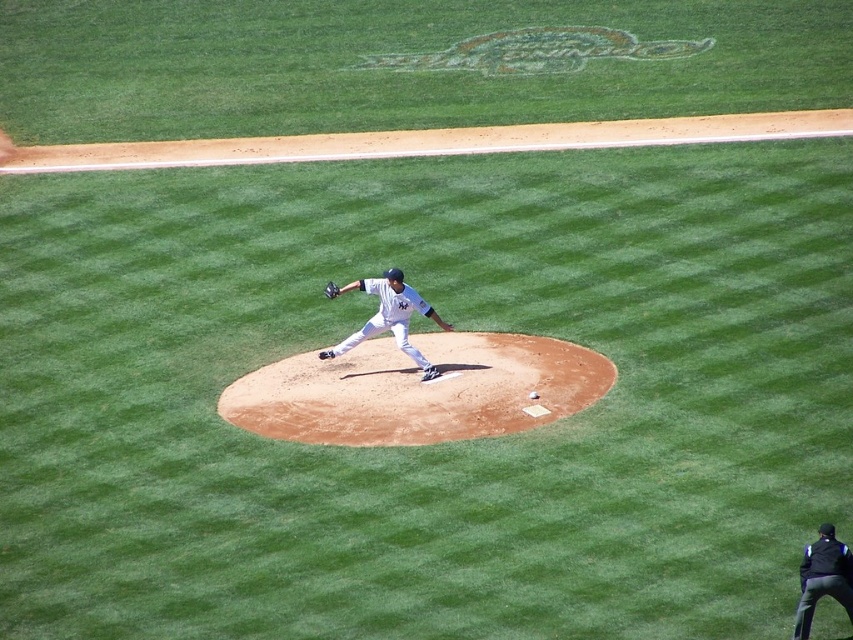
How much distance is there between white matte uniform at center and white matte baseball at center?

white matte uniform at center is 1.68 meters away from white matte baseball at center.

Is white matte uniform at center in front of white matte baseball at center?

No, it is not.

Image resolution: width=853 pixels, height=640 pixels. Find the location of `white matte uniform at center`. white matte uniform at center is located at coordinates (390, 317).

I want to click on white matte uniform at center, so click(390, 317).

Who is more distant from viewer, (409, 301) or (326, 289)?

Positioned behind is point (326, 289).

Does point (404, 321) come closer to viewer compared to point (337, 289)?

Yes, point (404, 321) is in front of point (337, 289).

Where is `white matte uniform at center`? white matte uniform at center is located at coordinates (390, 317).

Measure the distance from brown dirt mound at center to white matte baseball at center.

They are 4.57 feet apart.

Is brown dirt mound at center behind white matte baseball at center?

No.

This screenshot has width=853, height=640. In order to click on brown dirt mound at center in this screenshot , I will do `click(419, 390)`.

Find the location of a particular element. This screenshot has height=640, width=853. brown dirt mound at center is located at coordinates (419, 390).